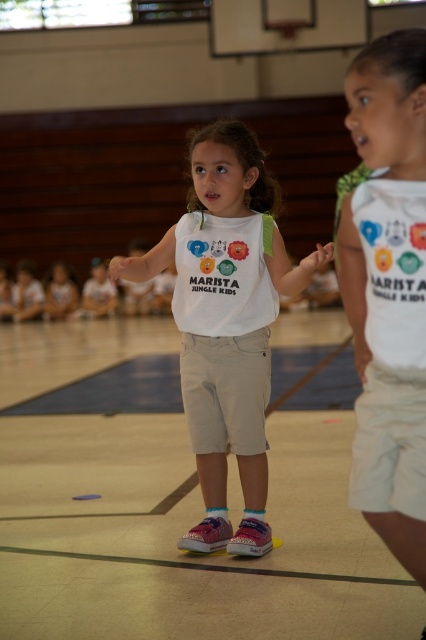
You are standing at the origin point of the gymnasium floor. There is a point labeled as point (388, 289). Which object in the scene corresponds to this coordinate?

The white cotton shirt at upper right corresponds to the coordinate point (388, 289).

You are observing two children in the gymnasium. The first child is wearing smooth beige shorts at center, and the second is wearing a white cotton shirt at upper right. From your perspective, which clothing item is positioned to the left?

The smooth beige shorts at center is to the left of the white cotton shirt at upper right.

You are standing in the gymnasium and want to take a photo of both the point at coordinates point [411,257] and the point at coordinates point [218,304]. Which point should you focus on first to ensure both are in focus?

You should focus on the point at coordinates point [411,257] first because it is closer to the camera than the point at coordinates point [218,304]. By focusing on the closer point, the farther point will also be in focus due to the depth of field.